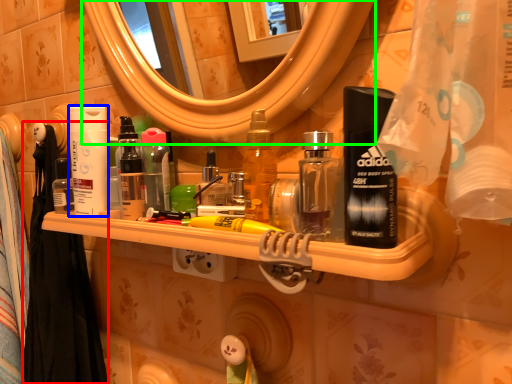
Question: Which object is positioned farthest from shower curtain (highlighted by a red box)? Select from cleaning product (highlighted by a blue box) and mirror (highlighted by a green box).

Choices:
 (A) cleaning product
 (B) mirror

Answer: (B)